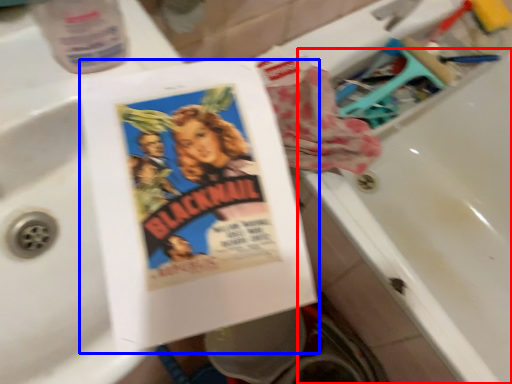
Question: Which point is closer to the camera, bath (highlighted by a red box) or paperback book (highlighted by a blue box)?

Choices:
 (A) bath
 (B) paperback book

Answer: (B)